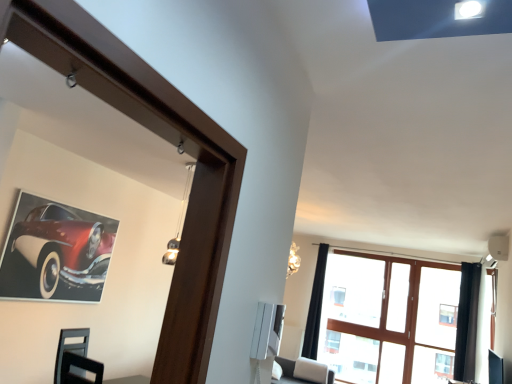
Question: Is black fabric curtain at upper right, which ranks as the first curtain in left-to-right order, positioned before shiny red car at upper left?

Choices:
 (A) no
 (B) yes

Answer: (A)

Question: Is black fabric curtain at upper right, the 2th curtain from the front, positioned behind shiny red car at upper left?

Choices:
 (A) no
 (B) yes

Answer: (B)

Question: From the image's perspective, is black fabric curtain at upper right, the 2th curtain from the front, located above shiny red car at upper left?

Choices:
 (A) no
 (B) yes

Answer: (A)

Question: Does black fabric curtain at upper right, the 2th curtain from the front, appear on the left side of shiny red car at upper left?

Choices:
 (A) no
 (B) yes

Answer: (A)

Question: Considering the relative sizes of black fabric curtain at upper right, marked as the second curtain in a right-to-left arrangement, and shiny red car at upper left in the image provided, is black fabric curtain at upper right, marked as the second curtain in a right-to-left arrangement, shorter than shiny red car at upper left?

Choices:
 (A) no
 (B) yes

Answer: (A)

Question: Could shiny red car at upper left be considered to be inside black fabric curtain at upper right, marked as the 1th curtain in a back-to-front arrangement?

Choices:
 (A) yes
 (B) no

Answer: (B)

Question: Can you confirm if clear glass window at upper center is positioned to the right of black fabric curtain at upper right, marked as the second curtain in a right-to-left arrangement?

Choices:
 (A) yes
 (B) no

Answer: (A)

Question: Considering the relative positions of clear glass window at upper center and black fabric curtain at upper right, which ranks as the first curtain in left-to-right order, in the image provided, is clear glass window at upper center to the left of black fabric curtain at upper right, which ranks as the first curtain in left-to-right order, from the viewer's perspective?

Choices:
 (A) no
 (B) yes

Answer: (A)

Question: Is clear glass window at upper center taller than black fabric curtain at upper right, marked as the 1th curtain in a back-to-front arrangement?

Choices:
 (A) no
 (B) yes

Answer: (B)

Question: Is clear glass window at upper center outside black fabric curtain at upper right, which ranks as the first curtain in left-to-right order?

Choices:
 (A) yes
 (B) no

Answer: (A)

Question: From the image's perspective, does clear glass window at upper center appear lower than black fabric curtain at upper right, the 2th curtain from the front?

Choices:
 (A) yes
 (B) no

Answer: (A)

Question: Is the surface of clear glass window at upper center in direct contact with black fabric curtain at upper right, the 2th curtain from the front?

Choices:
 (A) no
 (B) yes

Answer: (A)

Question: Could you tell me if black fabric curtain at upper right, marked as the 1th curtain in a back-to-front arrangement, is facing black velvet curtain at right, which appears as the 1th curtain when viewed from the right?

Choices:
 (A) yes
 (B) no

Answer: (B)